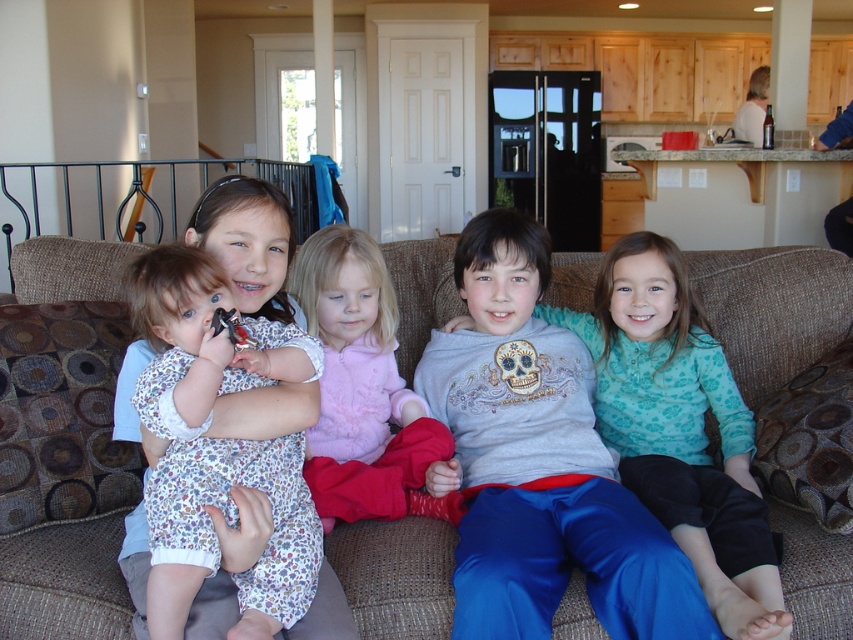
Question: Can you confirm if matte gray sweatshirt at center is positioned to the left of floral dress at center?

Choices:
 (A) yes
 (B) no

Answer: (B)

Question: Among these points, which one is farthest from the camera?

Choices:
 (A) (347, 301)
 (B) (27, 248)
 (C) (312, 592)

Answer: (B)

Question: Where is brown fabric couch at center located in relation to fluffy pink sweater at center in the image?

Choices:
 (A) below
 (B) above

Answer: (B)

Question: Which point is closer to the camera?

Choices:
 (A) (444, 358)
 (B) (347, 232)
 (C) (209, 349)

Answer: (C)

Question: Which of the following is the farthest from the observer?

Choices:
 (A) fluffy pink sweater at center
 (B) matte gray sweatshirt at center

Answer: (A)

Question: Can you confirm if brown fabric couch at center is smaller than fluffy pink sweater at center?

Choices:
 (A) no
 (B) yes

Answer: (B)